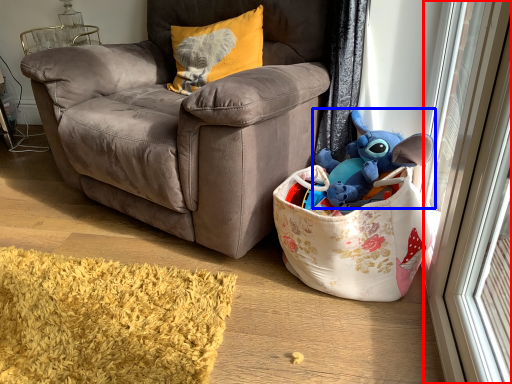
Question: Among these objects, which one is farthest to the camera, screen door (highlighted by a red box) or toy (highlighted by a blue box)?

Choices:
 (A) screen door
 (B) toy

Answer: (B)